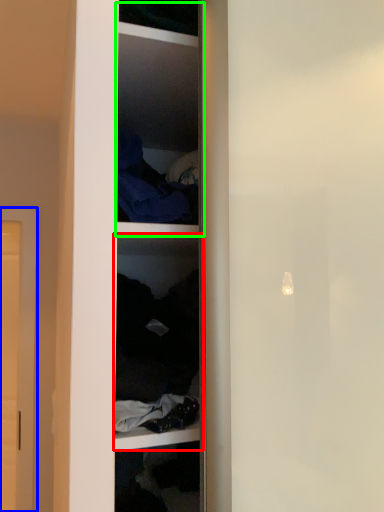
Question: Based on their relative distances, which object is farther from shelf (highlighted by a red box)? Choose from door (highlighted by a blue box) and cabinet (highlighted by a green box).

Choices:
 (A) door
 (B) cabinet

Answer: (A)